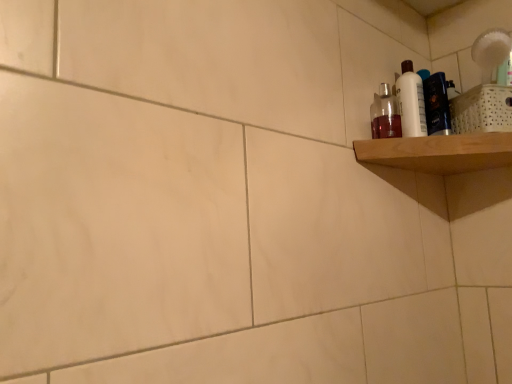
What do you see at coordinates (438, 152) in the screenshot? The width and height of the screenshot is (512, 384). I see `wooden shelf at upper right` at bounding box center [438, 152].

Describe the element at coordinates (385, 114) in the screenshot. I see `translucent plastic bottle at upper right` at that location.

Locate an element on the screen. Image resolution: width=512 pixels, height=384 pixels. white glossy bottle at upper right is located at coordinates (411, 102).

Does wooden shelf at upper right have a greater width compared to white glossy bottle at upper right?

Yes.

Can you tell me how much wooden shelf at upper right and white glossy bottle at upper right differ in facing direction?

wooden shelf at upper right and white glossy bottle at upper right are facing 64.3 degrees away from each other.

From the picture: Considering their positions, is wooden shelf at upper right located in front of or behind white glossy bottle at upper right?

wooden shelf at upper right is positioned closer to the viewer than white glossy bottle at upper right.

Do you think wooden shelf at upper right is within white glossy bottle at upper right, or outside of it?

wooden shelf at upper right is outside white glossy bottle at upper right.

Would you consider translucent plastic bottle at upper right to be distant from white glossy bottle at upper right?

translucent plastic bottle at upper right is near white glossy bottle at upper right, not far away.

Would you say translucent plastic bottle at upper right is to the left or to the right of white glossy bottle at upper right in the picture?

Clearly, translucent plastic bottle at upper right is on the left of white glossy bottle at upper right in the image.

From a real-world perspective, relative to white glossy bottle at upper right, is translucent plastic bottle at upper right vertically above or below?

translucent plastic bottle at upper right is below white glossy bottle at upper right.

I want to click on cleaning product above the translucent plastic bottle at upper right (from the image's perspective), so click(x=411, y=102).

Locate an element on the screen. The width and height of the screenshot is (512, 384). shelf on the right side of white glossy bottle at upper right is located at coordinates (438, 152).

Does white glossy bottle at upper right have a lesser height compared to wooden shelf at upper right?

Incorrect, the height of white glossy bottle at upper right does not fall short of that of wooden shelf at upper right.

Is point (408, 86) closer or farther from the camera than point (354, 146)?

Clearly, point (408, 86) is more distant from the camera than point (354, 146).

Is the position of white glossy bottle at upper right more distant than that of wooden shelf at upper right?

That is True.

Looking at this image, is white glossy bottle at upper right far away from translucent plastic bottle at upper right?

They are positioned close to each other.

Can translucent plastic bottle at upper right be found inside white glossy bottle at upper right?

Definitely not — translucent plastic bottle at upper right is not inside white glossy bottle at upper right.

Which point is more distant from viewer, [409,132] or [386,106]?

Point [386,106]

Is translucent plastic bottle at upper right located within wooden shelf at upper right?

No, translucent plastic bottle at upper right is located outside of wooden shelf at upper right.

From a real-world perspective, is wooden shelf at upper right located beneath translucent plastic bottle at upper right?

Yes, from a real-world perspective, wooden shelf at upper right is beneath translucent plastic bottle at upper right.

Looking at their sizes, would you say wooden shelf at upper right is wider or thinner than translucent plastic bottle at upper right?

In the image, wooden shelf at upper right appears to be wider than translucent plastic bottle at upper right.

This screenshot has height=384, width=512. Identify the location of shelf below the translucent plastic bottle at upper right (from a real-world perspective). (438, 152).

From a real-world perspective, is translucent plastic bottle at upper right physically located above or below wooden shelf at upper right?

In terms of real-world spatial position, translucent plastic bottle at upper right is above wooden shelf at upper right.

How many degrees apart are the facing directions of translucent plastic bottle at upper right and wooden shelf at upper right?

The angular difference between translucent plastic bottle at upper right and wooden shelf at upper right is 48.2 degrees.

Which is nearer, (x=375, y=108) or (x=417, y=141)?

Clearly, point (x=375, y=108) is more distant from the camera than point (x=417, y=141).

Identify the location of shelf in front of the white glossy bottle at upper right. This screenshot has height=384, width=512. (438, 152).

Find the location of a particular element. cleaning product behind the translucent plastic bottle at upper right is located at coordinates point(411,102).

When comparing their distances from translucent plastic bottle at upper right, does white glossy bottle at upper right or wooden shelf at upper right seem further?

The object further to translucent plastic bottle at upper right is wooden shelf at upper right.

Looking at the image, which one is located closer to wooden shelf at upper right, translucent plastic bottle at upper right or white glossy bottle at upper right?

Among the two, white glossy bottle at upper right is located nearer to wooden shelf at upper right.

Looking at the image, which one is located further to white glossy bottle at upper right, wooden shelf at upper right or translucent plastic bottle at upper right?

Based on the image, wooden shelf at upper right appears to be further to white glossy bottle at upper right.

Estimate the real-world distances between objects in this image. Which object is further from wooden shelf at upper right, white glossy bottle at upper right or translucent plastic bottle at upper right?

translucent plastic bottle at upper right.

From the image, which object appears to be farther from white glossy bottle at upper right, translucent plastic bottle at upper right or wooden shelf at upper right?

Based on the image, wooden shelf at upper right appears to be further to white glossy bottle at upper right.

Considering their positions, is wooden shelf at upper right positioned closer to translucent plastic bottle at upper right than white glossy bottle at upper right?

white glossy bottle at upper right.

The image size is (512, 384). I want to click on mouthwash positioned between wooden shelf at upper right and white glossy bottle at upper right from near to far, so (385, 114).